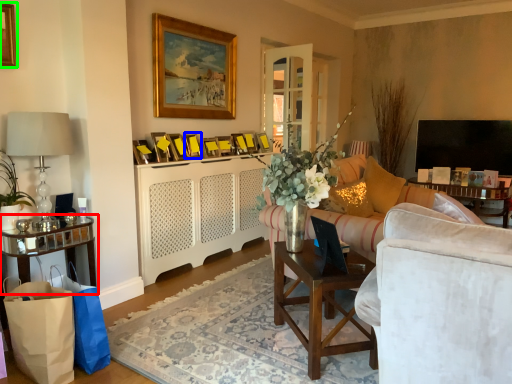
Question: Based on their relative distances, which object is nearer to table (highlighted by a red box)? Choose from picture frame (highlighted by a blue box) and picture frame (highlighted by a green box).

Choices:
 (A) picture frame
 (B) picture frame

Answer: (B)